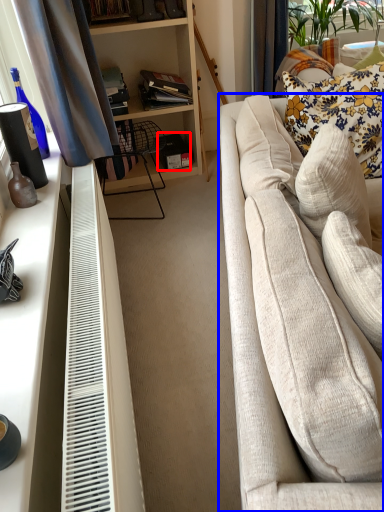
Question: Which of the following is the closest to the observer, box (highlighted by a red box) or studio couch (highlighted by a blue box)?

Choices:
 (A) box
 (B) studio couch

Answer: (B)